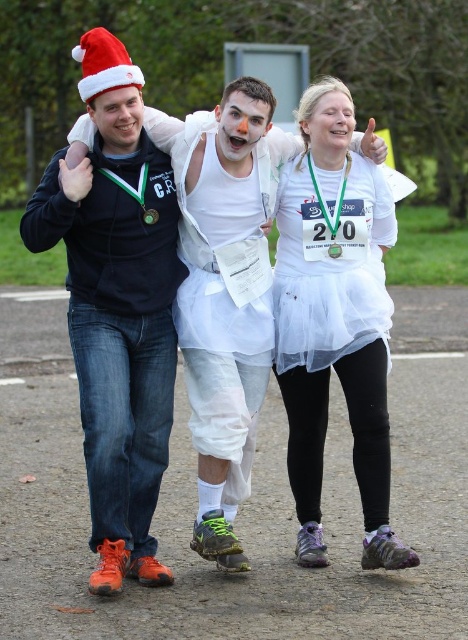
Question: Which object appears farthest from the camera in this image?

Choices:
 (A) matte white face at center
 (B) matte black hoodie at center
 (C) white matte clown nose at center

Answer: (C)

Question: Can you confirm if white tulle skirt at center is wider than white matte tutu at center?

Choices:
 (A) yes
 (B) no

Answer: (B)

Question: Which of the following is the farthest from the observer?

Choices:
 (A) white matte tutu at center
 (B) smooth white face at center
 (C) white matte clown nose at center
 (D) matte white face at center

Answer: (B)

Question: Where is matte black hoodie at center located in relation to smooth white face at center in the image?

Choices:
 (A) right
 (B) left

Answer: (B)

Question: Which of these objects is positioned farthest from the white tulle skirt at center?

Choices:
 (A) white matte clown nose at center
 (B) white matte tutu at center
 (C) matte white face at center

Answer: (C)

Question: Considering the relative positions of white tulle skirt at center and white matte clown nose at center in the image provided, where is white tulle skirt at center located with respect to white matte clown nose at center?

Choices:
 (A) right
 (B) left

Answer: (A)